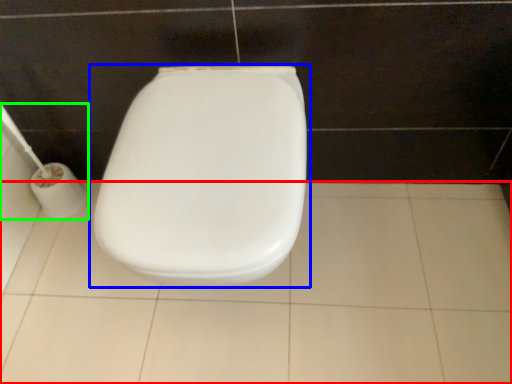
Question: Which object is positioned farthest from ceramic tile (highlighted by a red box)? Select from toilet (highlighted by a blue box) and toilet paper (highlighted by a green box).

Choices:
 (A) toilet
 (B) toilet paper

Answer: (B)